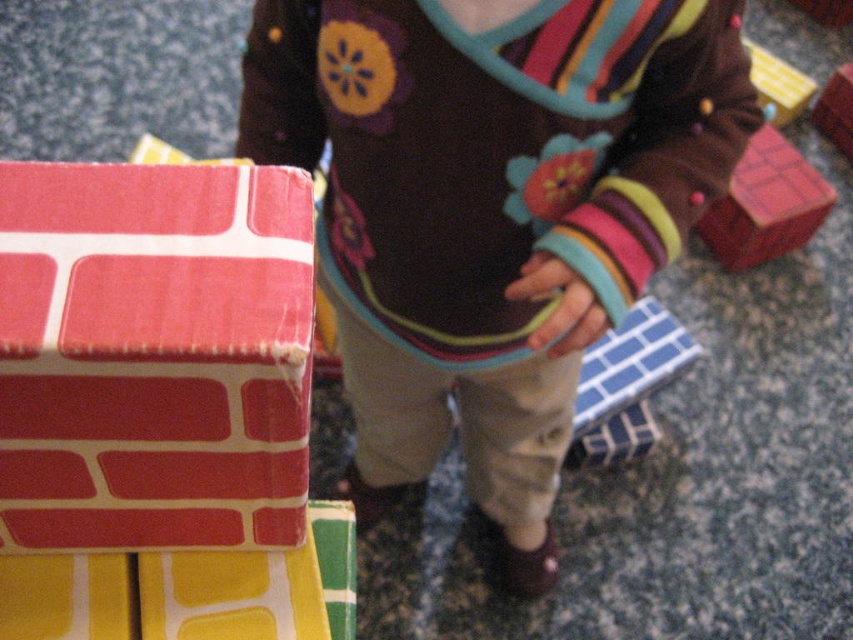
Question: Does floral sweater at center appear on the right side of brick-patterned cardboard at left?

Choices:
 (A) yes
 (B) no

Answer: (A)

Question: Is the position of floral sweater at center less distant than that of wooden house at upper right?

Choices:
 (A) yes
 (B) no

Answer: (A)

Question: Which point is closer to the camera taking this photo?

Choices:
 (A) (732, 193)
 (B) (80, 198)
 (C) (775, 84)
 (D) (438, 307)

Answer: (B)

Question: Estimate the real-world distances between objects in this image. Which object is closer to the wooden house at upper right?

Choices:
 (A) brick-patterned cardboard at left
 (B) matte red brick at right
 (C) floral sweater at center

Answer: (B)

Question: Is matte red brick at right to the right of wooden house at upper right from the viewer's perspective?

Choices:
 (A) yes
 (B) no

Answer: (B)

Question: Among these objects, which one is farthest from the camera?

Choices:
 (A) brick-patterned cardboard at left
 (B) matte red brick at right
 (C) floral sweater at center
 (D) wooden house at upper right

Answer: (D)